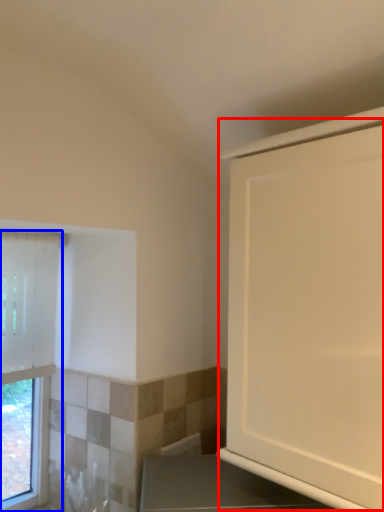
Question: Among these objects, which one is nearest to the camera, screen door (highlighted by a red box) or window (highlighted by a blue box)?

Choices:
 (A) screen door
 (B) window

Answer: (A)